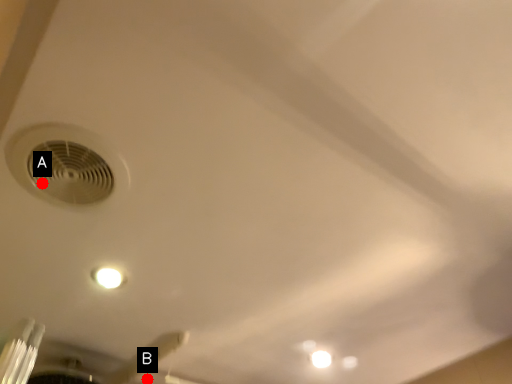
Question: Two points are circled on the image, labeled by A and B beside each circle. Which point is closer to the camera?

Choices:
 (A) A is closer
 (B) B is closer

Answer: (A)